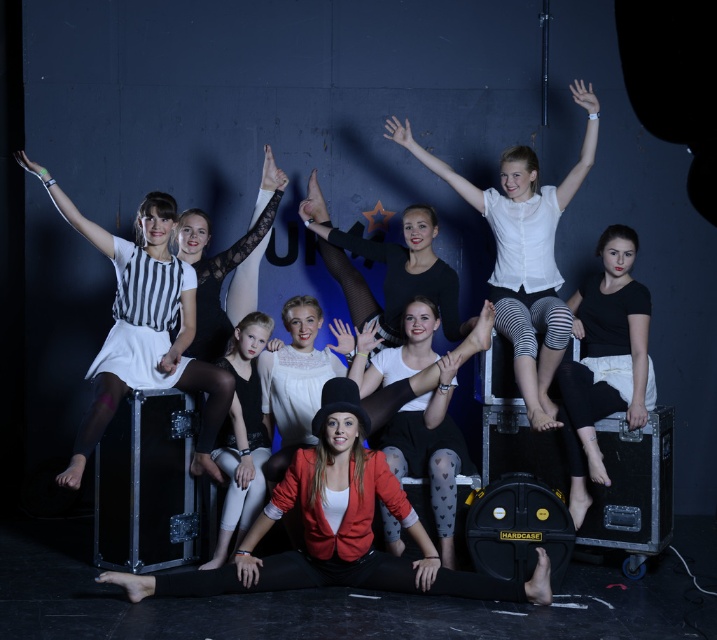
Can you confirm if red matte blazer at center is shorter than matte black dress at center?

Yes, red matte blazer at center is shorter than matte black dress at center.

Which is below, red matte blazer at center or matte black dress at center?

red matte blazer at center is lower down.

Does point (234, 566) come behind point (234, 440)?

No, (234, 566) is in front of (234, 440).

At what (x,y) coordinates should I click in order to perform the action: click on red matte blazer at center. Please return your answer as a coordinate pair (x, y). This screenshot has width=717, height=640. Looking at the image, I should click on (337, 529).

What are the coordinates of `white matte tights at center` in the screenshot? It's located at (424, 404).

Is point (446, 440) behind point (303, 369)?

No.

I want to click on white matte tights at center, so 424,404.

Who is higher up, red matte blazer at center or white sheer blouse at center?

white sheer blouse at center

Is red matte blazer at center to the left of white sheer blouse at center from the viewer's perspective?

Correct, you'll find red matte blazer at center to the left of white sheer blouse at center.

Between point (490, 592) and point (398, 138), which one is positioned in front?

Point (490, 592) is more forward.

At what (x,y) coordinates should I click in order to perform the action: click on red matte blazer at center. Please return your answer as a coordinate pair (x, y). Looking at the image, I should click on (337, 529).